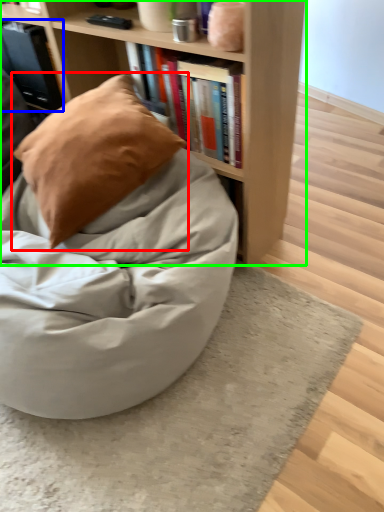
Question: Considering the real-world distances, which object is closest to pillow (highlighted by a red box)? book (highlighted by a blue box) or bookcase (highlighted by a green box).

Choices:
 (A) book
 (B) bookcase

Answer: (B)